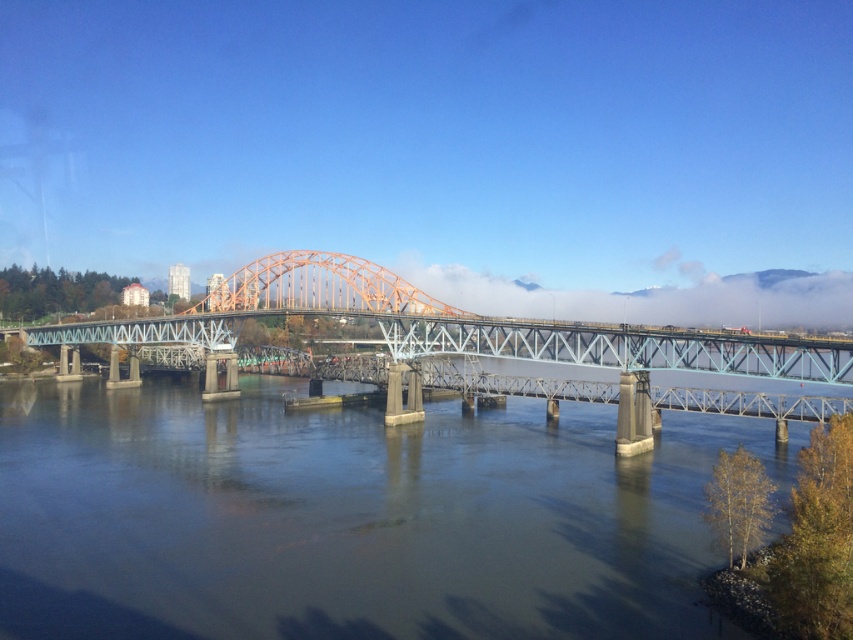
What do you see at coordinates (352, 516) in the screenshot?
I see `smooth concrete river at center` at bounding box center [352, 516].

Locate an element on the screen. smooth concrete river at center is located at coordinates (352, 516).

Is point (419, 616) closer to viewer compared to point (759, 360)?

Yes, point (419, 616) is closer to viewer.

At what (x,y) coordinates should I click in order to perform the action: click on smooth concrete river at center. Please return your answer as a coordinate pair (x, y). This screenshot has height=640, width=853. Looking at the image, I should click on (352, 516).